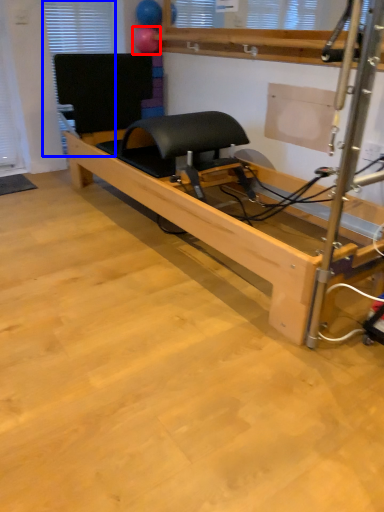
Question: Which point is closer to the camera, balloon (highlighted by a red box) or window (highlighted by a blue box)?

Choices:
 (A) balloon
 (B) window

Answer: (B)